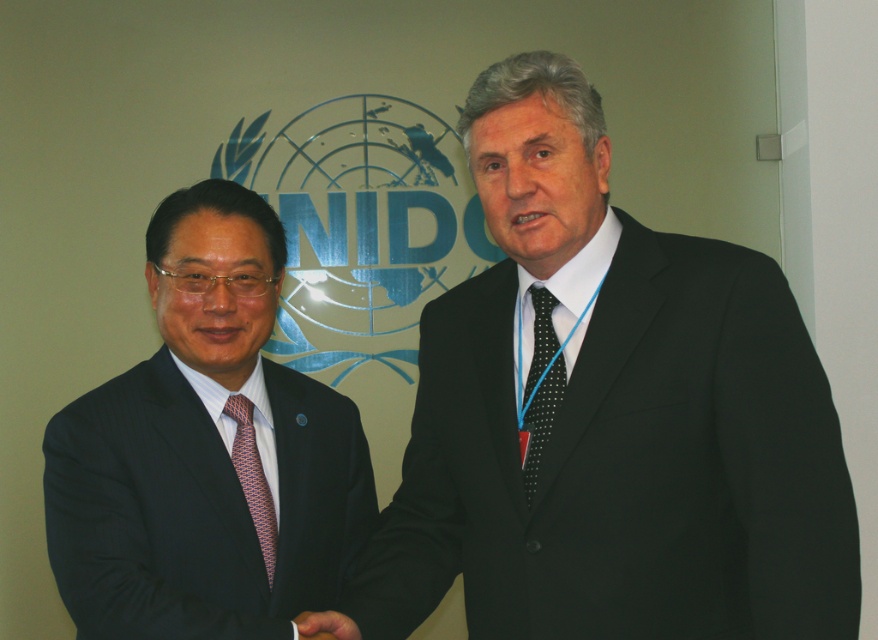
Is dark blue pinstripe suit at left closer to the viewer compared to orange and blue woven tie at left?

Yes, dark blue pinstripe suit at left is closer to the viewer.

Is dark blue pinstripe suit at left thinner than orange and blue woven tie at left?

No.

Image resolution: width=878 pixels, height=640 pixels. I want to click on dark blue pinstripe suit at left, so click(x=206, y=451).

Does black dotted tie at center have a larger size compared to orange and blue woven tie at left?

No.

From the picture: Between black dotted tie at center and orange and blue woven tie at left, which one appears on the left side from the viewer's perspective?

Positioned to the left is orange and blue woven tie at left.

Who is more distant from viewer, (551,355) or (247,406)?

Point (247,406)

Where is `black dotted tie at center`? Image resolution: width=878 pixels, height=640 pixels. black dotted tie at center is located at coordinates (541, 385).

Does dark blue pinstripe suit at left have a greater width compared to smooth skin hand at center?

Yes.

Can you confirm if dark blue pinstripe suit at left is positioned to the right of smooth skin hand at center?

Incorrect, dark blue pinstripe suit at left is not on the right side of smooth skin hand at center.

What are the coordinates of `dark blue pinstripe suit at left` in the screenshot? It's located at pyautogui.click(x=206, y=451).